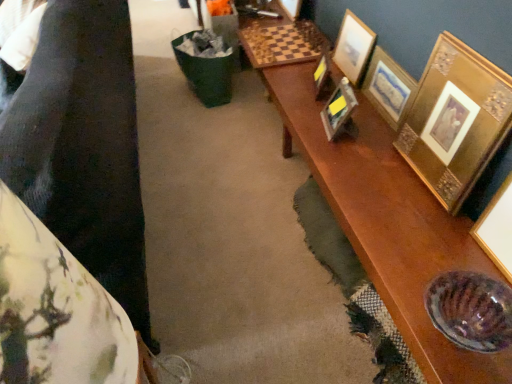
What is the approximate height of fluffy fabric cushion at left?

fluffy fabric cushion at left is 25.47 inches tall.

Measure the distance between gold textured picture frame at upper right, which is the 2th picture frame from right to left, and camera.

The depth of gold textured picture frame at upper right, which is the 2th picture frame from right to left, is 1.65 meters.

You are a GUI agent. You are given a task and a screenshot of the screen. Output one action in this format:
    pyautogui.click(x=<x>, y=<y>)
    Task: Click on the fluffy fabric cushion at left
    This screenshot has height=384, width=512.
    Given the screenshot: What is the action you would take?
    pos(84,146)

Is metallic gold picture frame at center, which is the second picture frame from left to right, next to gold textured picture frame at upper right, placed as the 4th picture frame when sorted from left to right, and touching it?

metallic gold picture frame at center, which is the second picture frame from left to right, is not next to gold textured picture frame at upper right, placed as the 4th picture frame when sorted from left to right, and they're not touching.

Looking at this image, from the image's perspective, relative to gold textured picture frame at upper right, which is the 2th picture frame from right to left, is metallic gold picture frame at center, acting as the 4th picture frame starting from the right, above or below?

metallic gold picture frame at center, acting as the 4th picture frame starting from the right, is below gold textured picture frame at upper right, which is the 2th picture frame from right to left.

In the scene shown: Is metallic gold picture frame at center, which is the second picture frame from left to right, bigger than gold textured picture frame at upper right, placed as the 4th picture frame when sorted from left to right?

Incorrect, metallic gold picture frame at center, which is the second picture frame from left to right, is not larger than gold textured picture frame at upper right, placed as the 4th picture frame when sorted from left to right.

Is metallic gold picture frame at center, which is the second picture frame from left to right, positioned beyond the bounds of gold textured picture frame at upper right, placed as the 4th picture frame when sorted from left to right?

Yes, metallic gold picture frame at center, which is the second picture frame from left to right, is not within gold textured picture frame at upper right, placed as the 4th picture frame when sorted from left to right.

From a real-world perspective, is gold ornate picture frame at right, which appears as the 1th picture frame when viewed from the right, under gold textured picture frame at upper right, placed as the 4th picture frame when sorted from left to right?

No, from a real-world perspective, gold ornate picture frame at right, which appears as the 1th picture frame when viewed from the right, is not below gold textured picture frame at upper right, placed as the 4th picture frame when sorted from left to right.

Is gold ornate picture frame at right, the fifth picture frame positioned from the left, completely or partially outside of gold textured picture frame at upper right, placed as the 4th picture frame when sorted from left to right?

That's correct, gold ornate picture frame at right, the fifth picture frame positioned from the left, is outside of gold textured picture frame at upper right, placed as the 4th picture frame when sorted from left to right.

Does gold ornate picture frame at right, the fifth picture frame positioned from the left, turn towards gold textured picture frame at upper right, which is the 2th picture frame from right to left?

No.

Find the location of `the 4th picture frame above when counting from the fluffy fabric cushion at left (from the image's perspective)`. the 4th picture frame above when counting from the fluffy fabric cushion at left (from the image's perspective) is located at coordinates (323, 77).

From a real-world perspective, is fluffy fabric cushion at left positioned over gold metallic picture frame at upper right, which ranks as the fifth picture frame in right-to-left order, based on gravity?

Yes, from a real-world perspective, fluffy fabric cushion at left is above gold metallic picture frame at upper right, which ranks as the fifth picture frame in right-to-left order.

What's the angular difference between fluffy fabric cushion at left and gold metallic picture frame at upper right, which ranks as the fifth picture frame in right-to-left order,'s facing directions?

73.8 degrees separate the facing orientations of fluffy fabric cushion at left and gold metallic picture frame at upper right, which ranks as the fifth picture frame in right-to-left order.

Is the position of fluffy fabric cushion at left less distant than that of gold textured picture frame at upper right, which is the 2th picture frame from right to left?

Yes, it is in front of gold textured picture frame at upper right, which is the 2th picture frame from right to left.

Are fluffy fabric cushion at left and gold textured picture frame at upper right, placed as the 4th picture frame when sorted from left to right, far apart?

Yes.

Consider the image. Do you think fluffy fabric cushion at left is within gold textured picture frame at upper right, which is the 2th picture frame from right to left, or outside of it?

fluffy fabric cushion at left exists outside the volume of gold textured picture frame at upper right, which is the 2th picture frame from right to left.

From the image's perspective, which picture frame is the 3rd one above the fluffy fabric cushion at left? Please provide its 2D coordinates.

[(388, 87)]

Looking at this image, from the image's perspective, is gold metallic picture frame at upper right, the 1th picture frame from the left, positioned above or below gold textured picture frame at upper right, which is the 2th picture frame from right to left?

gold metallic picture frame at upper right, the 1th picture frame from the left, is situated higher than gold textured picture frame at upper right, which is the 2th picture frame from right to left, in the image.

Is point (325, 65) behind point (380, 113)?

Yes, it is.

Is gold textured picture frame at upper right, placed as the 4th picture frame when sorted from left to right, a part of gold metallic picture frame at upper right, the 1th picture frame from the left?

Definitely not — gold textured picture frame at upper right, placed as the 4th picture frame when sorted from left to right, is not inside gold metallic picture frame at upper right, the 1th picture frame from the left.

Is gold metallic picture frame at upper right, the 1th picture frame from the left, turned away from gold textured picture frame at upper right, which is the 2th picture frame from right to left?

That's right, gold metallic picture frame at upper right, the 1th picture frame from the left, is facing away from gold textured picture frame at upper right, which is the 2th picture frame from right to left.

Who is bigger, gold textured frame at upper right, positioned as the third picture frame in left-to-right order, or metallic gold picture frame at center, acting as the 4th picture frame starting from the right?

gold textured frame at upper right, positioned as the third picture frame in left-to-right order.

Which is in front, gold textured frame at upper right, acting as the third picture frame starting from the right, or metallic gold picture frame at center, which is the second picture frame from left to right?

metallic gold picture frame at center, which is the second picture frame from left to right, is more forward.

From a real-world perspective, which is physically below, gold textured frame at upper right, acting as the third picture frame starting from the right, or metallic gold picture frame at center, acting as the 4th picture frame starting from the right?

metallic gold picture frame at center, acting as the 4th picture frame starting from the right, is physically lower.

Is fluffy fabric cushion at left surrounded by gold ornate picture frame at right, the fifth picture frame positioned from the left?

Definitely not — fluffy fabric cushion at left is not inside gold ornate picture frame at right, the fifth picture frame positioned from the left.

Is gold ornate picture frame at right, which appears as the 1th picture frame when viewed from the right, oriented away from fluffy fabric cushion at left?

That's not correct — gold ornate picture frame at right, which appears as the 1th picture frame when viewed from the right, is not looking away from fluffy fabric cushion at left.

Considering the points (479, 107) and (134, 257), which point is behind, point (479, 107) or point (134, 257)?

The point (479, 107) is behind.

Is gold ornate picture frame at right, which appears as the 1th picture frame when viewed from the right, not near fluffy fabric cushion at left?

Indeed, gold ornate picture frame at right, which appears as the 1th picture frame when viewed from the right, is not near fluffy fabric cushion at left.

Where is `the 1st picture frame in front of the metallic gold picture frame at center, which is the second picture frame from left to right`? The width and height of the screenshot is (512, 384). the 1st picture frame in front of the metallic gold picture frame at center, which is the second picture frame from left to right is located at coordinates (388, 87).

At what (x,y) coordinates should I click in order to perform the action: click on the 2nd picture frame located beneath the gold ornate picture frame at right, the fifth picture frame positioned from the left (from a real-world perspective). Please return your answer as a coordinate pair (x, y). The height and width of the screenshot is (384, 512). Looking at the image, I should click on (388, 87).

Which object lies further to the anchor point gold ornate picture frame at right, the fifth picture frame positioned from the left, gold textured frame at upper right, positioned as the third picture frame in left-to-right order, or metallic gold picture frame at center, acting as the 4th picture frame starting from the right?

Based on the image, gold textured frame at upper right, positioned as the third picture frame in left-to-right order, appears to be further to gold ornate picture frame at right, the fifth picture frame positioned from the left.

Considering their positions, is metallic gold picture frame at center, acting as the 4th picture frame starting from the right, positioned further to gold textured picture frame at upper right, which is the 2th picture frame from right to left, than gold textured frame at upper right, acting as the third picture frame starting from the right?

metallic gold picture frame at center, acting as the 4th picture frame starting from the right.

Which object lies further to the anchor point gold metallic picture frame at upper right, which ranks as the fifth picture frame in right-to-left order, metallic gold picture frame at center, acting as the 4th picture frame starting from the right, or gold ornate picture frame at right, which appears as the 1th picture frame when viewed from the right?

gold ornate picture frame at right, which appears as the 1th picture frame when viewed from the right, is further to gold metallic picture frame at upper right, which ranks as the fifth picture frame in right-to-left order.

Looking at the image, which one is located further to gold textured frame at upper right, acting as the third picture frame starting from the right, gold textured picture frame at upper right, placed as the 4th picture frame when sorted from left to right, or gold metallic picture frame at upper right, which ranks as the fifth picture frame in right-to-left order?

Based on the image, gold textured picture frame at upper right, placed as the 4th picture frame when sorted from left to right, appears to be further to gold textured frame at upper right, acting as the third picture frame starting from the right.

When comparing their distances from metallic gold picture frame at center, which is the second picture frame from left to right, does gold textured picture frame at upper right, placed as the 4th picture frame when sorted from left to right, or gold metallic picture frame at upper right, the 1th picture frame from the left, seem further?

gold textured picture frame at upper right, placed as the 4th picture frame when sorted from left to right.

From the image, which object appears to be nearer to gold metallic picture frame at upper right, which ranks as the fifth picture frame in right-to-left order, gold textured frame at upper right, acting as the third picture frame starting from the right, or gold textured picture frame at upper right, placed as the 4th picture frame when sorted from left to right?

gold textured frame at upper right, acting as the third picture frame starting from the right.

Based on their spatial positions, is gold ornate picture frame at right, which appears as the 1th picture frame when viewed from the right, or metallic gold picture frame at center, acting as the 4th picture frame starting from the right, closer to gold metallic picture frame at upper right, which ranks as the fifth picture frame in right-to-left order?

Based on the image, metallic gold picture frame at center, acting as the 4th picture frame starting from the right, appears to be nearer to gold metallic picture frame at upper right, which ranks as the fifth picture frame in right-to-left order.

From the image, which object appears to be nearer to metallic gold picture frame at center, acting as the 4th picture frame starting from the right, gold ornate picture frame at right, which appears as the 1th picture frame when viewed from the right, or fluffy fabric cushion at left?

Based on the image, gold ornate picture frame at right, which appears as the 1th picture frame when viewed from the right, appears to be nearer to metallic gold picture frame at center, acting as the 4th picture frame starting from the right.

This screenshot has width=512, height=384. What are the coordinates of `picture frame between gold ornate picture frame at right, the fifth picture frame positioned from the left, and metallic gold picture frame at center, which is the second picture frame from left to right, from front to back` in the screenshot? It's located at (388, 87).

Identify the location of picture frame positioned between fluffy fabric cushion at left and gold textured picture frame at upper right, which is the 2th picture frame from right to left, from near to far. The width and height of the screenshot is (512, 384). (455, 120).